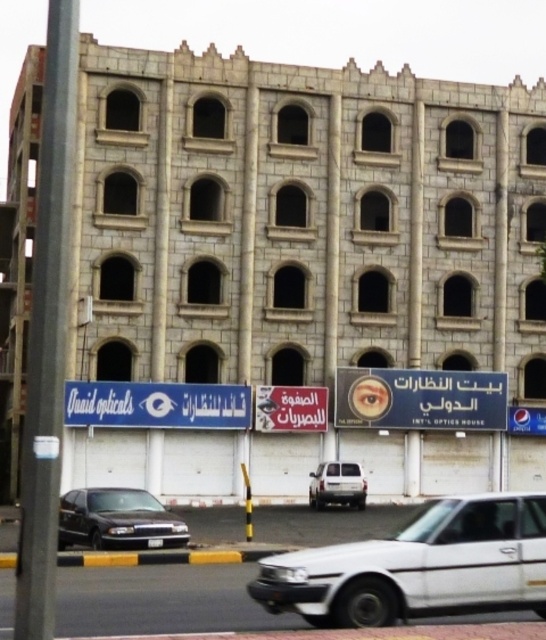
You are standing in front of the building and want to take a photo of the blue plastic signboard at center without the white matte car at lower right appearing in the frame. Is the car closer to you than the signboard?

The white matte car at lower right is closer to the viewer than blue plastic signboard at center, so yes, the car is closer and may block the signboard in the photo.

What is the color of the signboard located at point (420, 397)?

The point (420, 397) corresponds to a blue plastic signboard at center.

You are a delivery driver needing to park your 4.5 meter long truck between the white matte car at lower right and the shiny black sedan at lower left. Can you fit your truck in the available space between them?

The white matte car at lower right is 4.23 meters from the shiny black sedan at lower left. Since your truck is 4.5 meters long, it is slightly longer than the available space, so you cannot fit your truck between them.